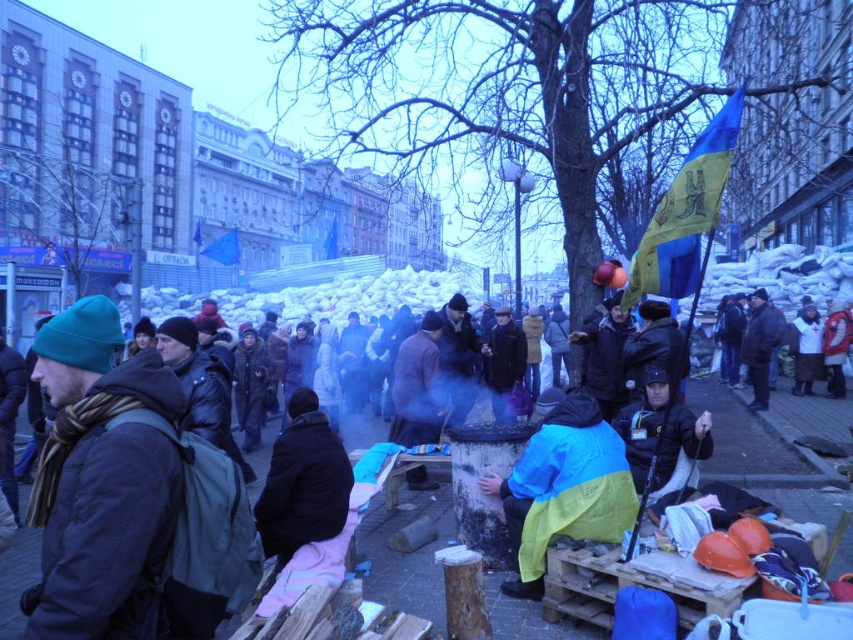
Question: Is dark blue jacket at center bigger than black woolen jacket at center?

Choices:
 (A) no
 (B) yes

Answer: (B)

Question: Can you confirm if dark blue jacket at center is positioned below blue/yellow fabric jacket at center?

Choices:
 (A) yes
 (B) no

Answer: (B)

Question: Which point is closer to the camera?

Choices:
 (A) (724, 458)
 (B) (297, 547)
 (C) (532, 572)

Answer: (B)

Question: Which is farther from the blue/yellow fabric jacket at center?

Choices:
 (A) dark blue jacket at center
 (B) black woolen jacket at center

Answer: (B)

Question: Is blue/yellow fabric jacket at center positioned behind black woolen jacket at center?

Choices:
 (A) no
 (B) yes

Answer: (B)

Question: Which object is farther from the camera taking this photo?

Choices:
 (A) black woolen jacket at center
 (B) blue/yellow fabric jacket at center
 (C) dark blue jacket at center

Answer: (B)